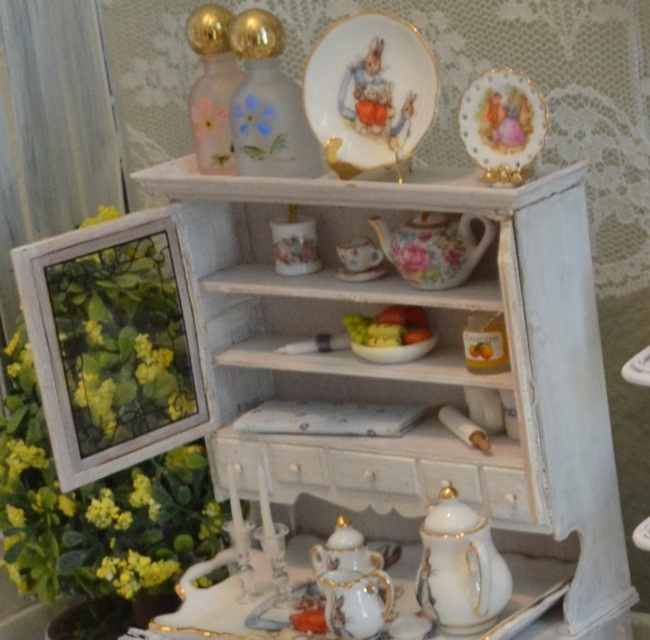
Question: Is white porcelain teapot at bottom right thinner than porcelain saucer at center?

Choices:
 (A) yes
 (B) no

Answer: (B)

Question: Which point is closer to the camera?

Choices:
 (A) porcelain teacup at middle
 (B) white painted wood drawer at center
 (C) porcelain teapot at lower center

Answer: (B)

Question: Does porcelain teacup at middle appear on the right side of porcelain saucer at center?

Choices:
 (A) yes
 (B) no

Answer: (B)

Question: Which point is farther to the camera?

Choices:
 (A) (332, 557)
 (B) (398, 230)
 (C) (374, 257)
 (D) (330, 460)

Answer: (D)

Question: Can you confirm if white painted wood cabinet at center is positioned above white porcelain teapot at bottom right?

Choices:
 (A) no
 (B) yes

Answer: (B)

Question: Which point is farther from the camera taking this photo?

Choices:
 (A) (448, 435)
 (B) (468, 544)
 (C) (339, 252)
 (D) (463, 138)

Answer: (A)